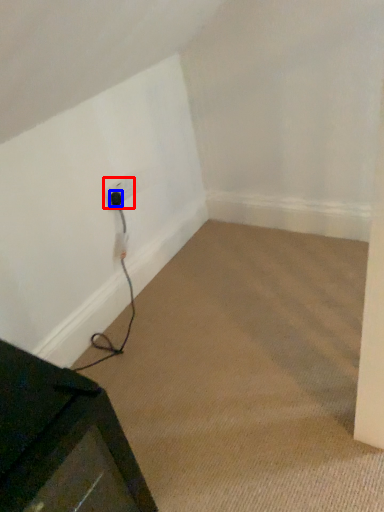
Question: Which object appears closest to the camera in this image, electric outlet (highlighted by a red box) or plug (highlighted by a blue box)?

Choices:
 (A) electric outlet
 (B) plug

Answer: (A)